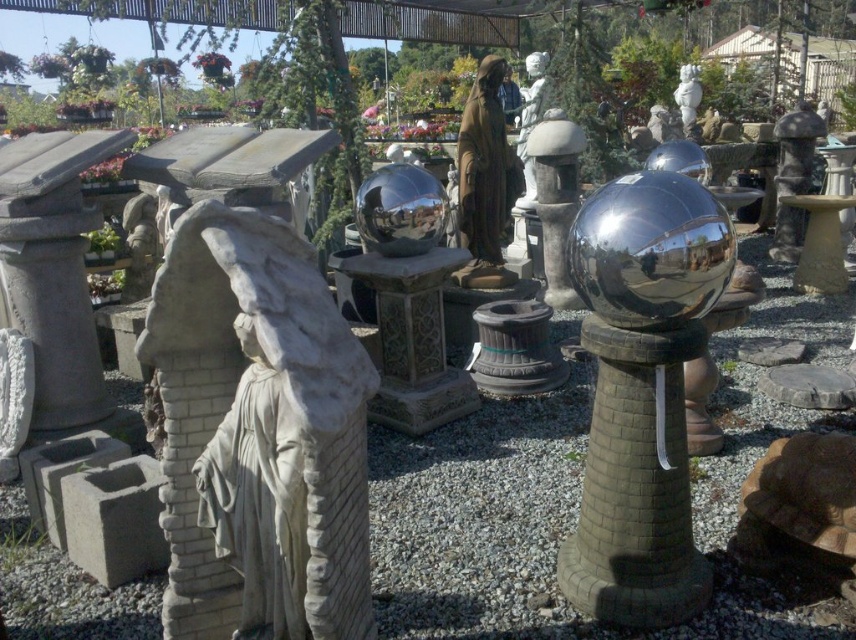
Question: Does white stone statue at left have a lesser width compared to glossy white statue at center?

Choices:
 (A) no
 (B) yes

Answer: (A)

Question: Considering the real-world distances, which object is farthest from the brown matte statue at center?

Choices:
 (A) white stone statue at left
 (B) glossy white statue at center

Answer: (A)

Question: Does white stone statue at left lie behind brown matte statue at center?

Choices:
 (A) yes
 (B) no

Answer: (B)

Question: Among these points, which one is nearest to the camera?

Choices:
 (A) (201, 412)
 (B) (465, 109)
 (C) (682, 67)

Answer: (A)

Question: Is white stone statue at left further to camera compared to brown matte statue at center?

Choices:
 (A) no
 (B) yes

Answer: (A)

Question: Which object appears closest to the camera in this image?

Choices:
 (A) glossy white statue at center
 (B) white stone statue at left

Answer: (B)